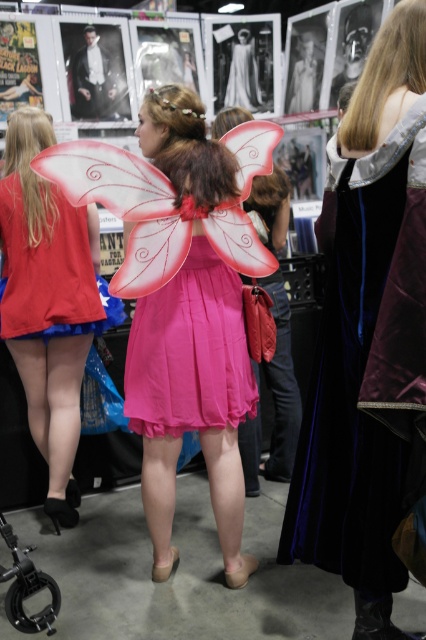
You are standing in the crowd at the costume event and want to take a photo of both the matte pink fabric dress at center and the matte red dress at center. Which dress should you focus on first to ensure both are in clear focus?

You should focus on the matte pink fabric dress at center first because it is closer to the viewer than the matte red dress at center, so adjusting focus from near to far will help both be in clear focus.

You are at a costume event and want to find a place to sit. There are two dresses in front of you, a matte pink fabric dress at center and a matte red dress at center. Which dress takes up more space horizontally?

The matte red dress at center has a greater width compared to the matte pink fabric dress at center, so it takes up more horizontal space.